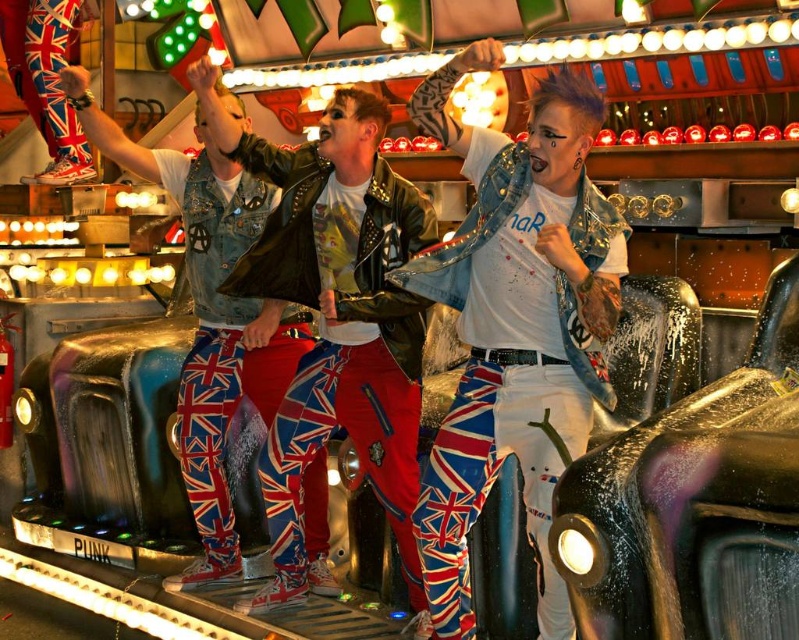
Question: Is union jack pants at center to the left of metallic purple car at right from the viewer's perspective?

Choices:
 (A) yes
 (B) no

Answer: (A)

Question: Does union jack pants at center lie in front of metallic purple car at right?

Choices:
 (A) no
 (B) yes

Answer: (A)

Question: Which object is closer to the camera taking this photo?

Choices:
 (A) metallic purple car at right
 (B) union jack pants at center

Answer: (A)

Question: Which object appears closest to the camera in this image?

Choices:
 (A) union jack pants at center
 (B) metallic purple car at right

Answer: (B)

Question: Can you confirm if union jack pants at center is smaller than metallic purple car at right?

Choices:
 (A) yes
 (B) no

Answer: (A)